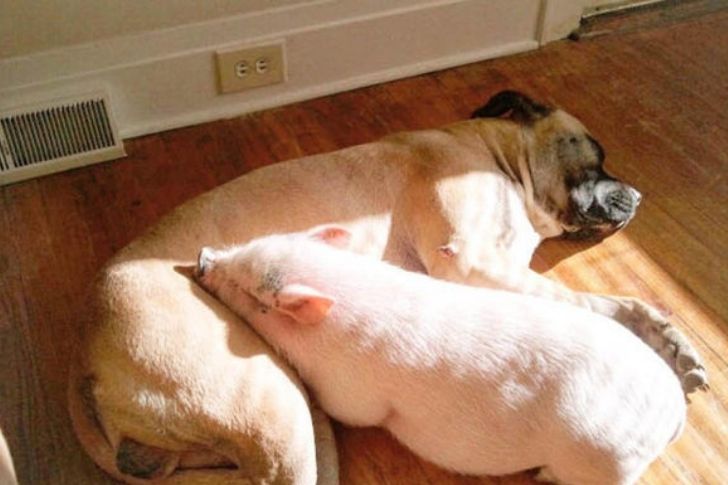
At what (x,y) coordinates should I click in order to perform the action: click on air vent. Please return your answer as a coordinate pair (x, y). The width and height of the screenshot is (728, 485). Looking at the image, I should click on (59, 140).